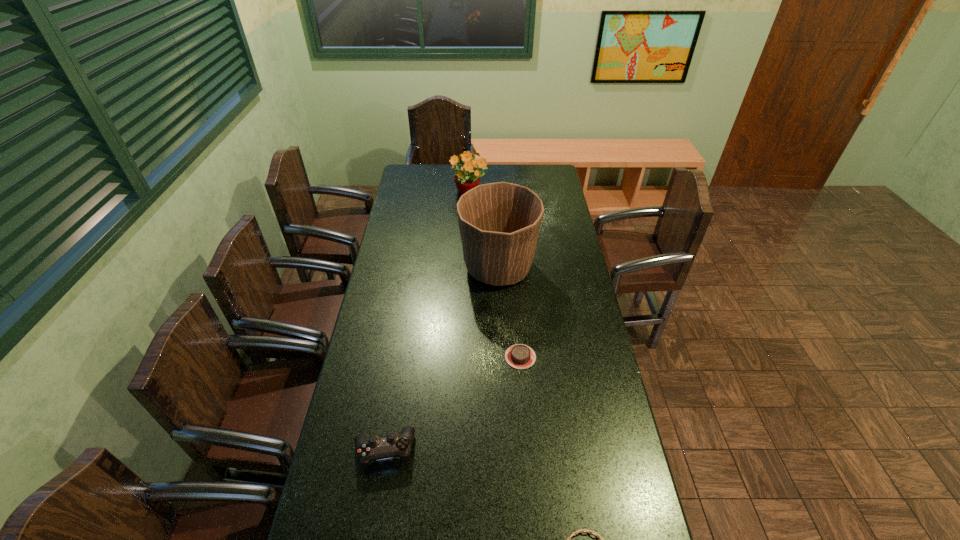
Where is `free point located on the back of the third tallest object`? This screenshot has height=540, width=960. free point located on the back of the third tallest object is located at coordinates (399, 359).

The image size is (960, 540). Find the location of `vacant space located on the left of the third farthest object`. vacant space located on the left of the third farthest object is located at coordinates pyautogui.click(x=397, y=357).

Locate an element on the screen. object positioned at the far edge is located at coordinates (469, 176).

Find the location of a particular element. The image size is (960, 540). object that is at the left edge is located at coordinates (374, 448).

Image resolution: width=960 pixels, height=540 pixels. Find the location of `vacant space at the far edge`. vacant space at the far edge is located at coordinates (504, 172).

Where is `vacant space at the left edge of the desktop`? This screenshot has height=540, width=960. vacant space at the left edge of the desktop is located at coordinates (406, 197).

Find the location of a particular element. The image size is (960, 540). vacant area at the right edge of the desktop is located at coordinates (590, 323).

This screenshot has width=960, height=540. In order to click on vacant space that is in between the third tallest object and the farthest object in this screenshot , I will do `click(427, 322)`.

Where is `vacant point located between the nearer flowerpot and the chocolate cake`? vacant point located between the nearer flowerpot and the chocolate cake is located at coordinates (509, 313).

Find the location of `unoccupied area between the leftmost object and the chocolate cake`. unoccupied area between the leftmost object and the chocolate cake is located at coordinates (452, 403).